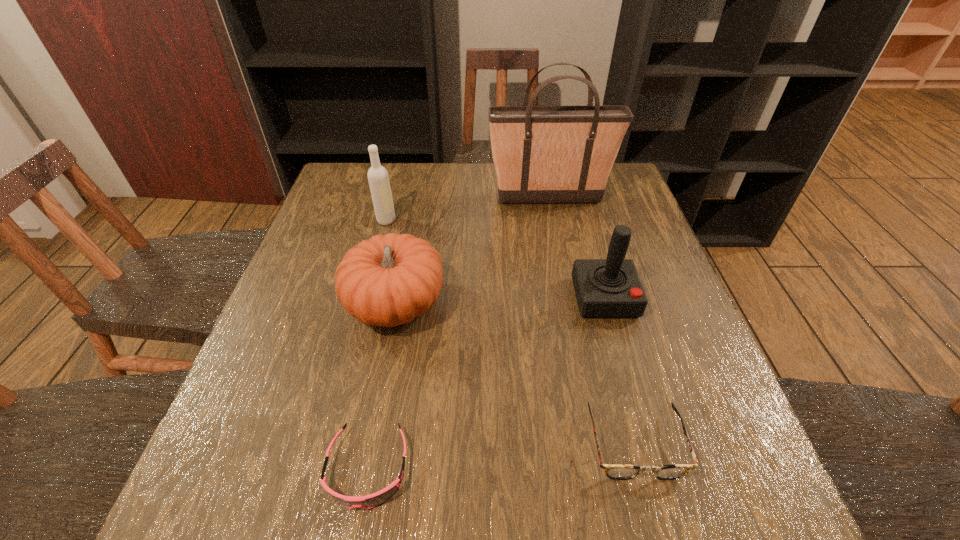
This screenshot has width=960, height=540. I want to click on free space that is in between the pumpkin and the joystick, so click(x=500, y=301).

The image size is (960, 540). In order to click on unoccupied area between the third shortest object and the goggles in this screenshot , I will do `click(381, 387)`.

This screenshot has height=540, width=960. I want to click on empty location between the goggles and the second farthest object, so click(377, 345).

Locate an element on the screen. empty location between the pumpkin and the goggles is located at coordinates (381, 387).

The height and width of the screenshot is (540, 960). Find the location of `free space between the joystick and the fifth nearest object`. free space between the joystick and the fifth nearest object is located at coordinates (495, 259).

You are a GUI agent. You are given a task and a screenshot of the screen. Output one action in this format:
    pyautogui.click(x=<x>, y=<y>)
    Task: Click on the free space between the joystick and the vodka
    
    Given the screenshot: What is the action you would take?
    pyautogui.click(x=495, y=259)

I want to click on object that stands as the third closest to the fourth tallest object, so click(x=542, y=154).

Locate which object is the fifth closest to the goggles. Please provide its 2D coordinates. Your answer should be formatted as a tuple, i.e. [(x, y)], where the tuple contains the x and y coordinates of a point satisfying the conditions above.

[(542, 154)]